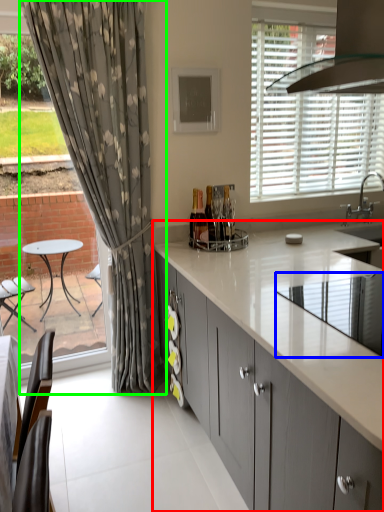
Question: Based on their relative distances, which object is farther from cabinetry (highlighted by a red box)? Choose from appliance (highlighted by a blue box) and curtain (highlighted by a green box).

Choices:
 (A) appliance
 (B) curtain

Answer: (B)